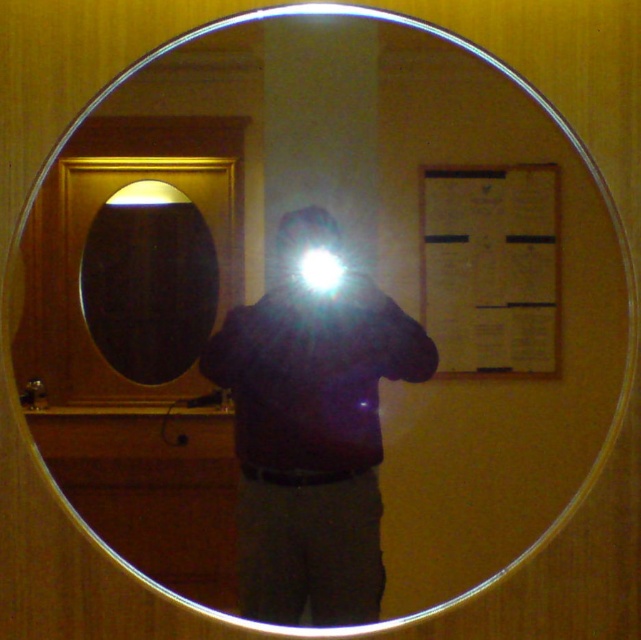
Does dark matte jacket at center have a greater height compared to matte black oval mirror at left?

Correct, dark matte jacket at center is much taller as matte black oval mirror at left.

Between point (310, 339) and point (124, 224), which one is positioned in front?

Point (124, 224) is more forward.

At what (x,y) coordinates should I click in order to perform the action: click on dark matte jacket at center. Please return your answer as a coordinate pair (x, y). This screenshot has height=640, width=641. Looking at the image, I should click on (312, 433).